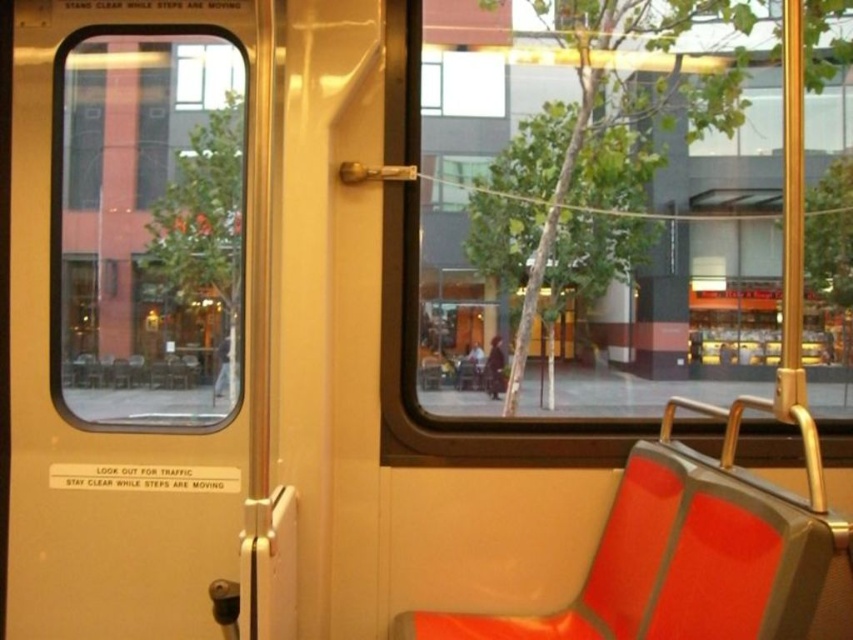
Question: Which is farther from the dark gray fabric coach at center?

Choices:
 (A) transparent glass window at center
 (B) transparent glass window at left
 (C) orange fabric seat at right

Answer: (B)

Question: Observing the image, what is the correct spatial positioning of orange fabric seat at right in reference to dark gray fabric coach at center?

Choices:
 (A) right
 (B) left

Answer: (A)

Question: Can you confirm if transparent glass window at left is positioned below orange fabric seat at right?

Choices:
 (A) yes
 (B) no

Answer: (B)

Question: Which point is farther to the camera?

Choices:
 (A) orange fabric seat at right
 (B) transparent glass window at left

Answer: (B)

Question: Which point is farther to the camera?

Choices:
 (A) (828, 592)
 (B) (106, 305)
 (C) (614, 452)
 (D) (498, 376)

Answer: (D)

Question: From the image, what is the correct spatial relationship of orange fabric seat at right in relation to transparent glass window at center?

Choices:
 (A) left
 (B) right

Answer: (B)